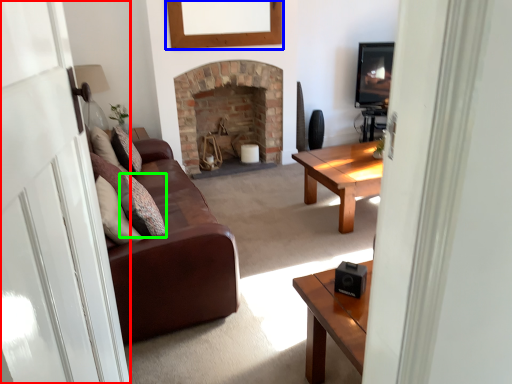
Question: Which object is the farthest from glass door (highlighted by a red box)? Choose among these: picture frame (highlighted by a blue box) or pillow (highlighted by a green box).

Choices:
 (A) picture frame
 (B) pillow

Answer: (A)